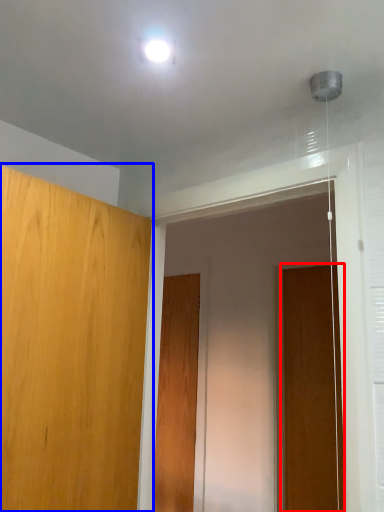
Question: Which point is closer to the camera, door (highlighted by a red box) or door (highlighted by a blue box)?

Choices:
 (A) door
 (B) door

Answer: (B)